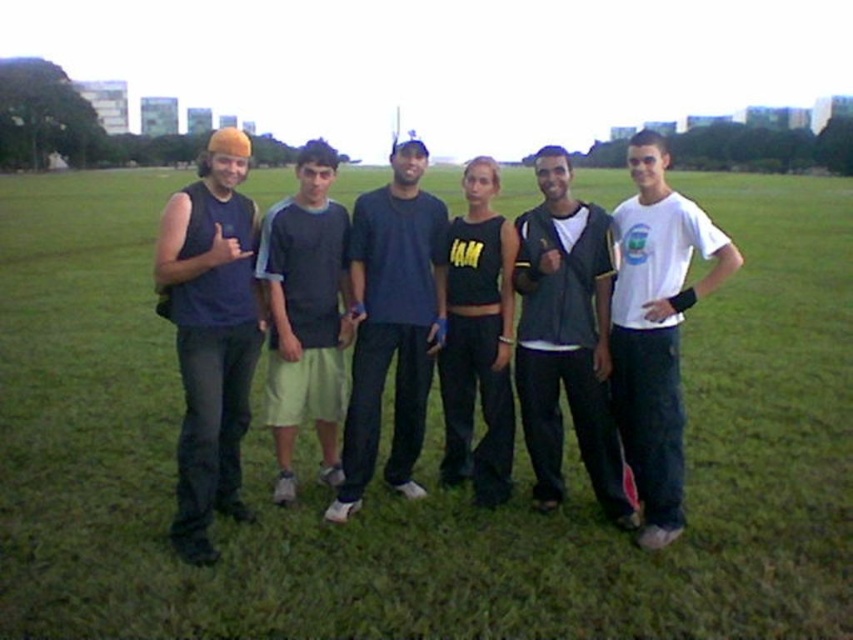
Question: Which object appears closest to the camera in this image?

Choices:
 (A) white cotton t-shirt at right
 (B) dark blue t-shirt at center

Answer: (A)

Question: Based on their relative distances, which object is nearer to the white cotton t-shirt at right?

Choices:
 (A) green grass at center
 (B) dark gray jacket at center
 (C) black matte tank top at center
 (D) matte blue tank top at left

Answer: (B)

Question: Is dark gray jacket at center above light green shorts at center?

Choices:
 (A) yes
 (B) no

Answer: (B)

Question: Among these objects, which one is farthest from the camera?

Choices:
 (A) light green shorts at center
 (B) dark gray jacket at center

Answer: (A)

Question: Is dark gray jacket at center to the left of light green shorts at center from the viewer's perspective?

Choices:
 (A) no
 (B) yes

Answer: (A)

Question: Is the position of white cotton t-shirt at right more distant than that of light green shorts at center?

Choices:
 (A) yes
 (B) no

Answer: (B)